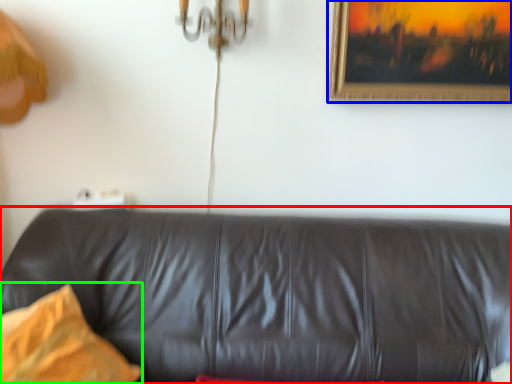
Question: Based on their relative distances, which object is nearer to studio couch (highlighted by a red box)? Choose from picture frame (highlighted by a blue box) and pillow (highlighted by a green box).

Choices:
 (A) picture frame
 (B) pillow

Answer: (B)